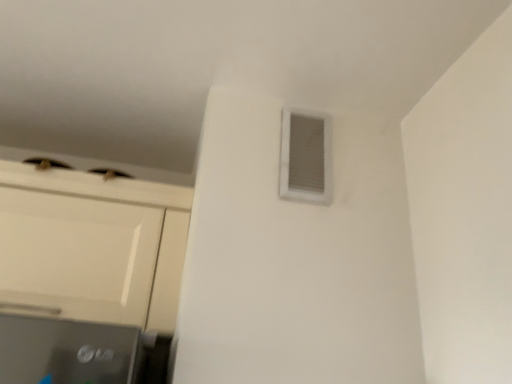
Question: Should I look upward or downward to see white plastic air conditioning at upper right?

Choices:
 (A) down
 (B) up

Answer: (B)